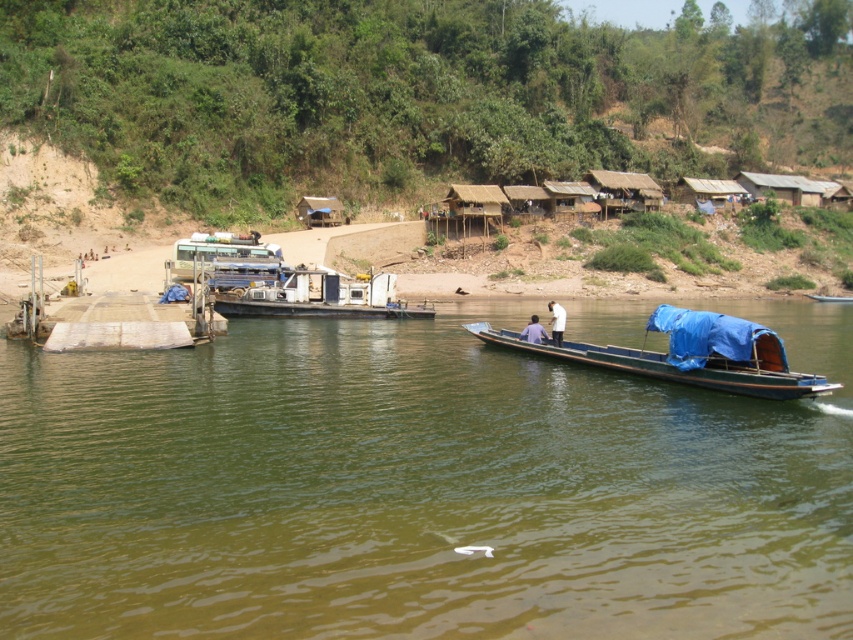
Based on the photo, you are a passenger on the ferry and want to take a photo of both the blue tarpaulin boat at lower right and the blue fabric boat at center. Which boat should you focus on first to ensure both are in the frame?

You should focus on the blue tarpaulin boat at lower right first since it is closer to you, allowing both boats to be captured in the frame.

What are the coordinates of the green matte water at center in the image?

The green matte water at center is located at coordinates point (419, 488).

You are a photographer planning to capture the entire scene of the green matte water at center and the metallic gray boat at center in one shot. Given that your camera has a fixed focal length, which object should you focus on first to ensure both are in frame?

The green matte water at center has a larger size compared to the metallic gray boat at center, so you should focus on the green matte water at center first to ensure both are in frame.